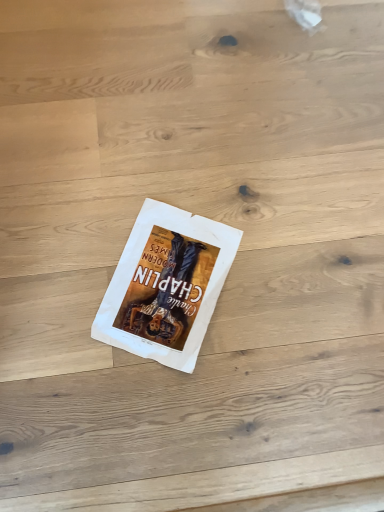
You are a GUI agent. You are given a task and a screenshot of the screen. Output one action in this format:
    pyautogui.click(x=<x>, y=<y>)
    Task: Click on the vacant space to the right of white paper book at center
    
    Given the screenshot: What is the action you would take?
    pyautogui.click(x=273, y=297)